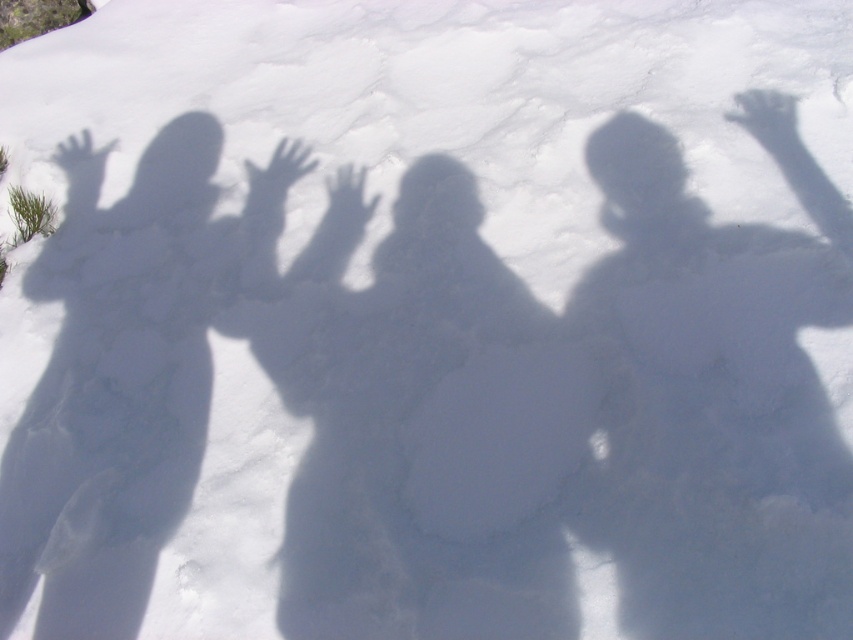
Question: Which object is positioned closest to the dark shadow figure at center?

Choices:
 (A) smooth shadow figure at left
 (B) smooth shadow figure at center

Answer: (B)

Question: Considering the relative positions of dark shadow figure at center and smooth shadow figure at left in the image provided, where is dark shadow figure at center located with respect to smooth shadow figure at left?

Choices:
 (A) above
 (B) below

Answer: (B)

Question: Which is nearer to the smooth shadow figure at center?

Choices:
 (A) dark shadow figure at center
 (B) smooth shadow figure at left

Answer: (A)

Question: Which of the following is the closest to the observer?

Choices:
 (A) smooth shadow figure at center
 (B) dark shadow figure at center
 (C) smooth shadow figure at left

Answer: (A)

Question: Is dark shadow figure at center bigger than smooth shadow figure at left?

Choices:
 (A) no
 (B) yes

Answer: (A)

Question: Does dark shadow figure at center have a larger size compared to smooth shadow figure at left?

Choices:
 (A) no
 (B) yes

Answer: (A)